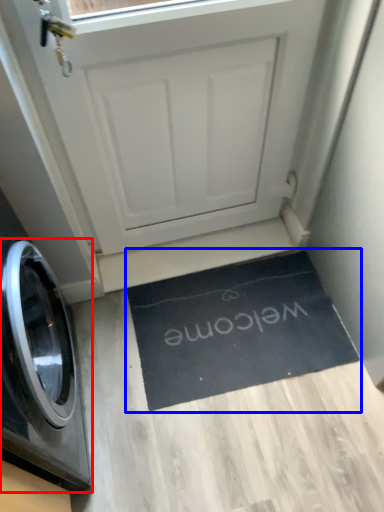
Question: Which object is further to the camera taking this photo, washing machine (highlighted by a red box) or doormat (highlighted by a blue box)?

Choices:
 (A) washing machine
 (B) doormat

Answer: (B)